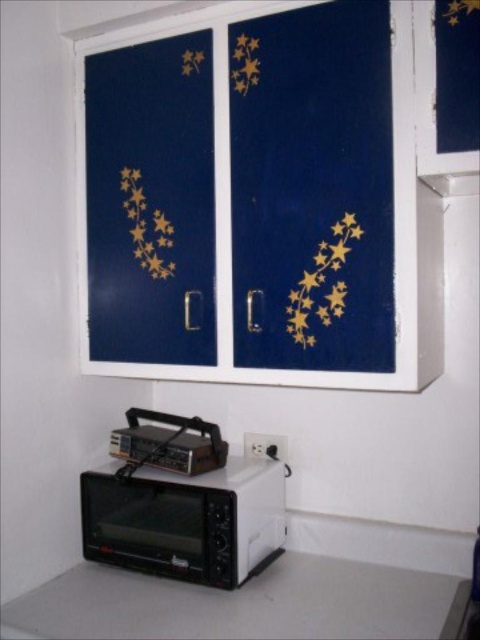
You are organizing the kitchen and need to place a new appliance between the blue painted cabinet at upper center and the white matte countertop at lower center. Based on their positions, which object should you place the appliance closer to?

The blue painted cabinet at upper center is positioned on the left side of the white matte countertop at lower center, so you should place the appliance closer to the blue painted cabinet at upper center since it is on the left side.